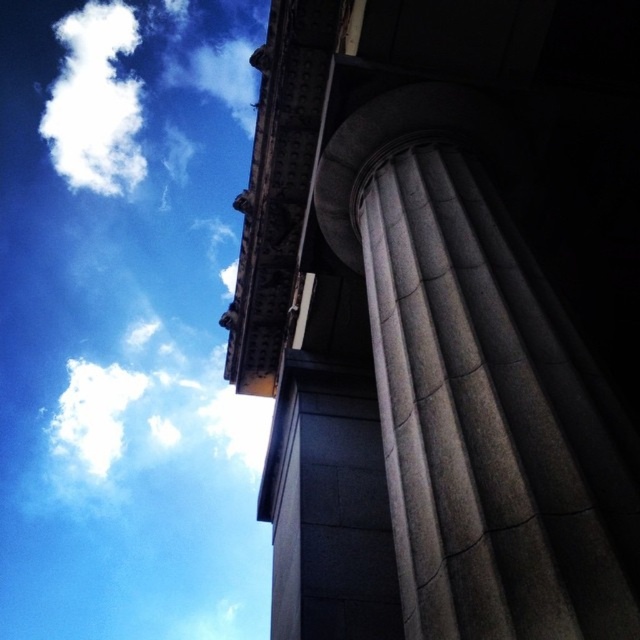
Question: Is gray stone column at upper right to the left of white fluffy cloud at upper left from the viewer's perspective?

Choices:
 (A) yes
 (B) no

Answer: (B)

Question: Which point is closer to the camera?

Choices:
 (A) gray stone column at upper right
 (B) white fluffy cloud at upper left

Answer: (A)

Question: Can you confirm if gray stone column at upper right is wider than white fluffy cloud at upper left?

Choices:
 (A) no
 (B) yes

Answer: (A)

Question: Is gray stone column at upper right wider than white fluffy cloud at upper left?

Choices:
 (A) yes
 (B) no

Answer: (B)

Question: Which of the following is the closest to the observer?

Choices:
 (A) white fluffy cloud at upper left
 (B) gray stone column at upper right

Answer: (B)